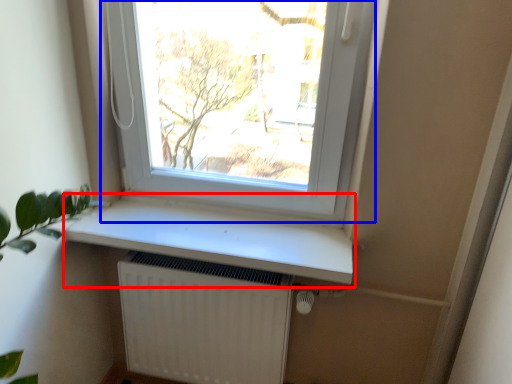
Question: Which object appears closest to the camera in this image, window sill (highlighted by a red box) or window (highlighted by a blue box)?

Choices:
 (A) window sill
 (B) window

Answer: (B)